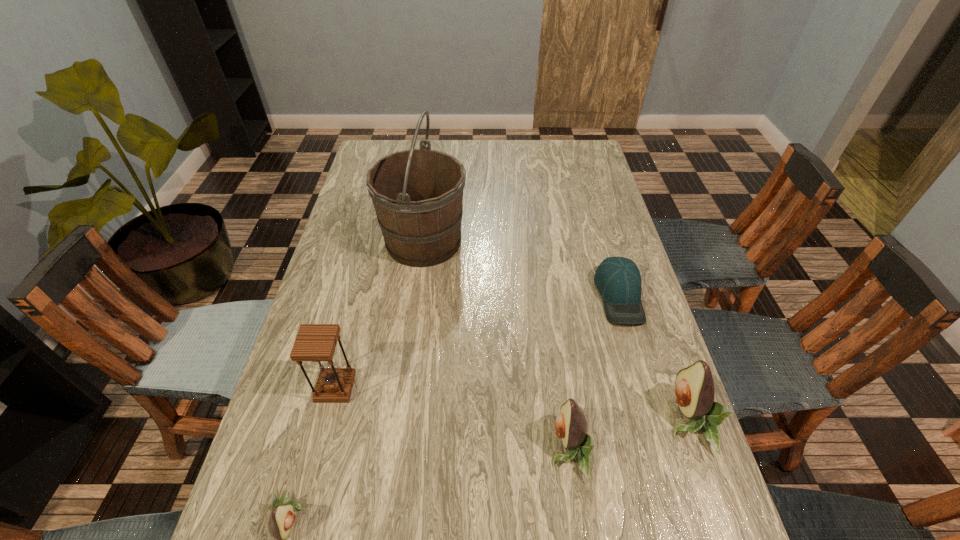
Please determine a free point for an extra avocado to ensure balance. Please provide its 2D coordinates. Your answer should be formatted as a tuple, i.e. [(x, y)], where the tuple contains the x and y coordinates of a point satisfying the conditions above.

[(437, 482)]